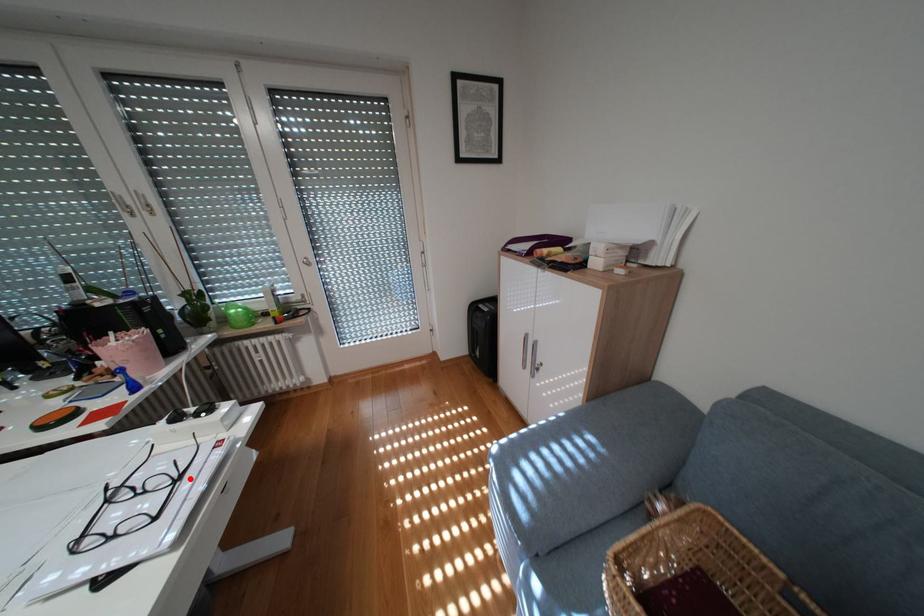
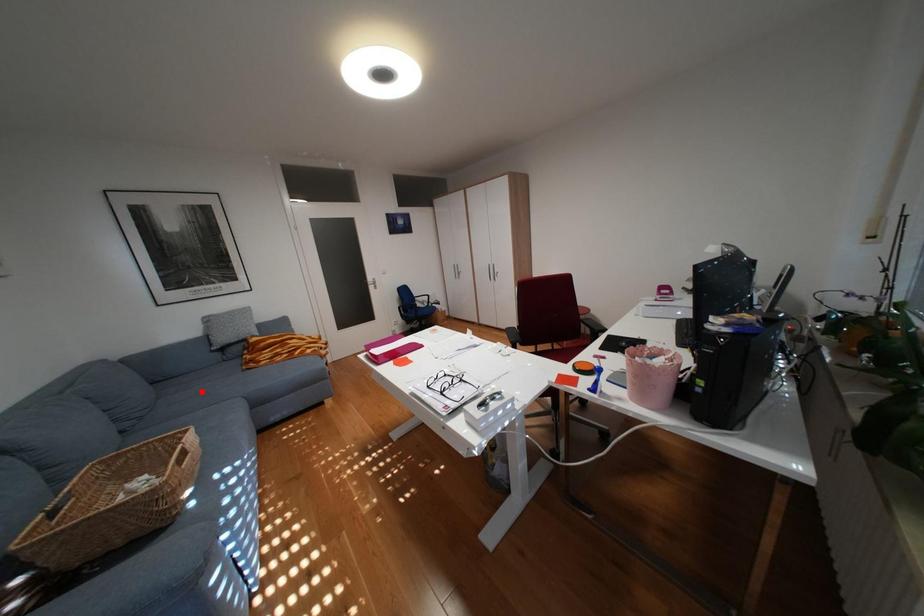
I am providing you with two images of the same scene from different viewpoints. A red point is marked on the first image and another point is marked on the second image. Is the marked point in image1 the same physical position as the marked point in image2?

No